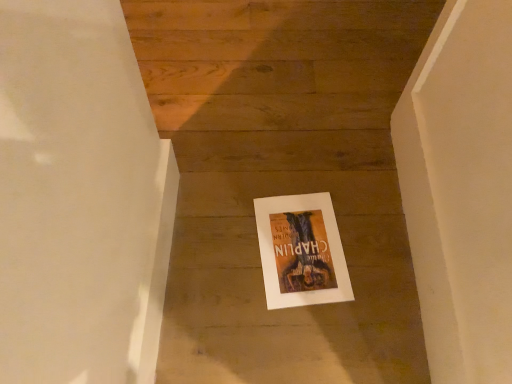
This screenshot has height=384, width=512. I want to click on free space in front of white paper at center, so click(x=295, y=337).